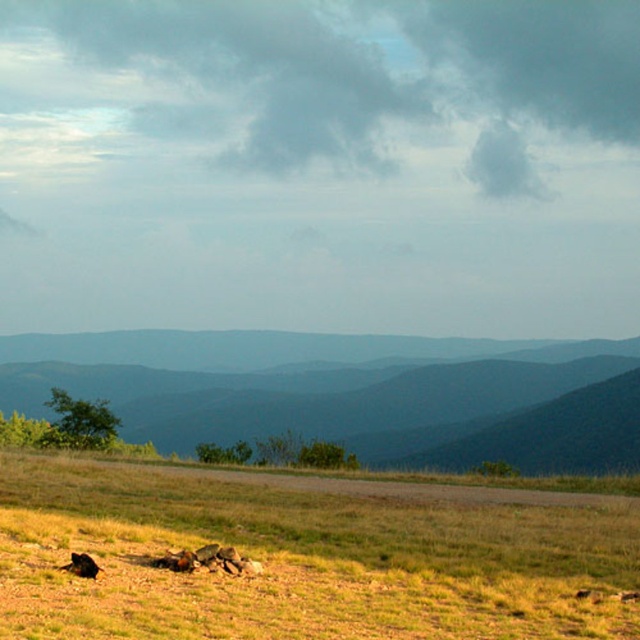
Does point (44, 339) come behind point (88, 554)?

That is True.

Is green grassy hillside at center shorter than shiny black dog at lower left?

No, green grassy hillside at center is not shorter than shiny black dog at lower left.

Where is `green grassy hillside at center`? The image size is (640, 640). green grassy hillside at center is located at coordinates [349, 392].